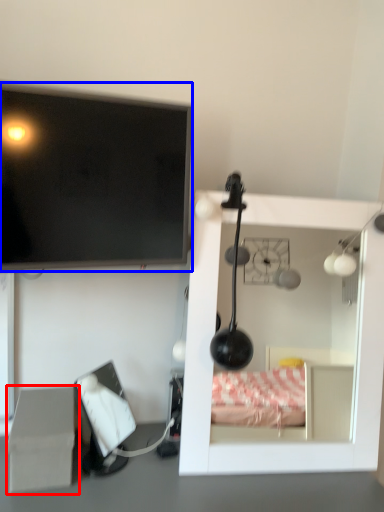
Question: Which of the following is the farthest to the observer, cardboard box (highlighted by a red box) or television (highlighted by a blue box)?

Choices:
 (A) cardboard box
 (B) television

Answer: (A)